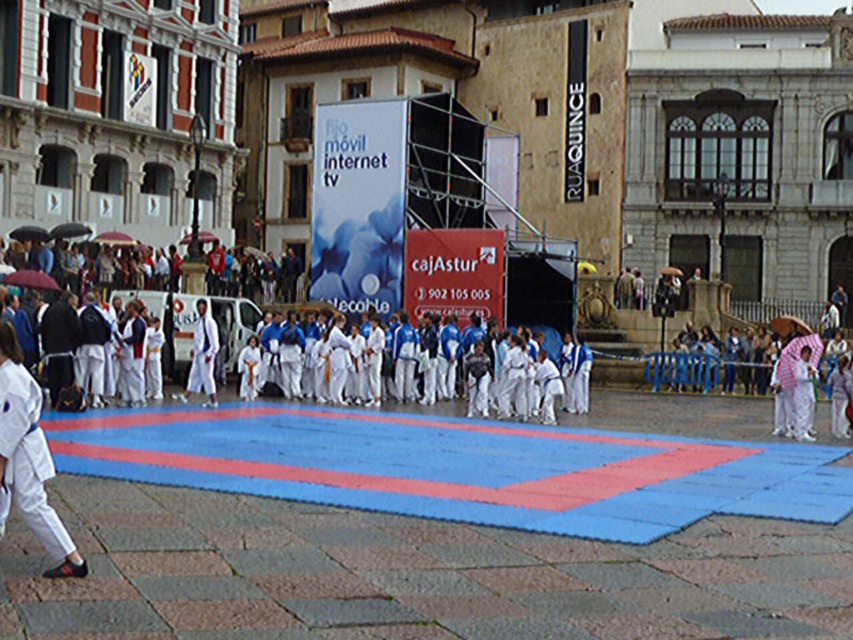
Question: Which object is the farthest from the white cotton clothing at upper center?

Choices:
 (A) white cotton karate gi at lower left
 (B) white cotton kimono at center
 (C) white cotton karate uniform at center

Answer: (A)

Question: Among these points, which one is farthest from the camera?

Choices:
 (A) (15, 461)
 (B) (190, 358)

Answer: (B)

Question: Does white cotton clothing at upper center come behind white cotton karate uniform at center?

Choices:
 (A) no
 (B) yes

Answer: (B)

Question: Can you confirm if white cotton karate gi at lower left is thinner than white cotton karate uniform at center?

Choices:
 (A) no
 (B) yes

Answer: (A)

Question: Estimate the real-world distances between objects in this image. Which object is farther from the white cotton karate uniform at center?

Choices:
 (A) white cotton kimono at center
 (B) white cotton clothing at upper center

Answer: (B)

Question: Is white cotton karate gi at lower left positioned in front of white cotton karate uniform at center?

Choices:
 (A) yes
 (B) no

Answer: (A)